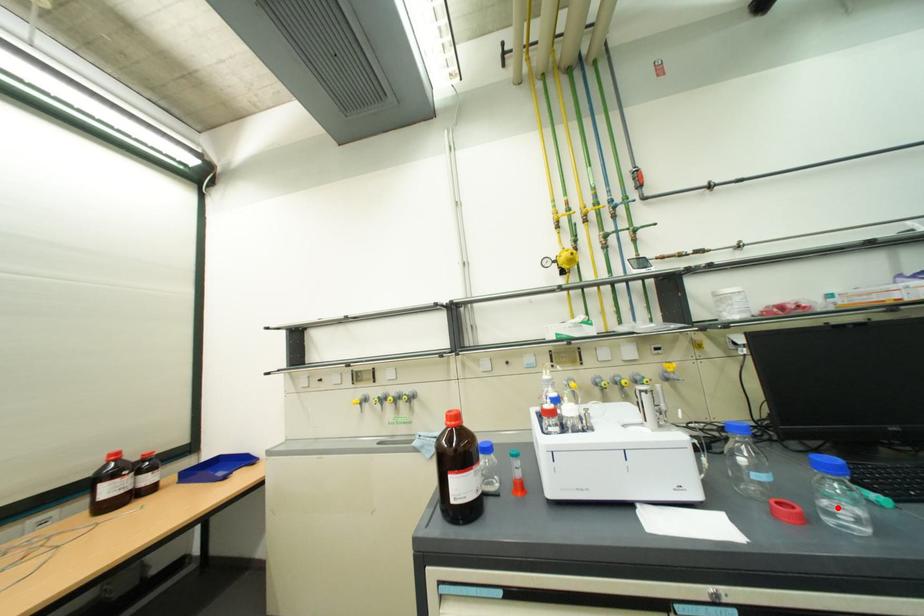
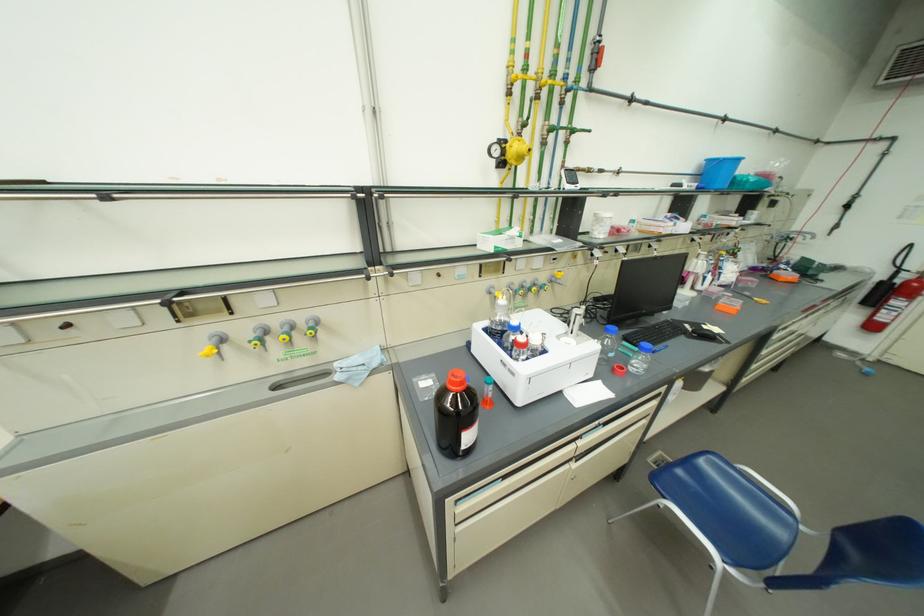
Where in the second image is the point corresponding to the highlighted location from the first image?

(642, 365)